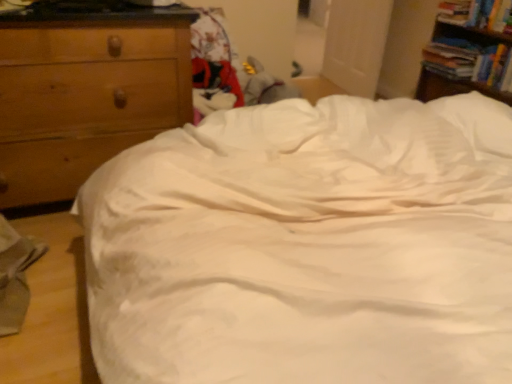
Identify the location of hardcover book at upper right, marked as the 3th book in a top-to-bottom arrangement. (451, 57).

What do you see at coordinates (451, 57) in the screenshot?
I see `hardcover book at upper right, the first book positioned from the bottom` at bounding box center [451, 57].

The width and height of the screenshot is (512, 384). In order to click on wooden bookshelf at upper right in this screenshot , I will do (x=468, y=51).

In order to face hardcover book at upper right, which is counted as the 3th book, starting from the bottom, should I rotate leftwards or rightwards?

Rotate your view right by about 25.763°.

At what (x,y) coordinates should I click in order to perform the action: click on hardcover book at upper right, marked as the 3th book in a top-to-bottom arrangement. Please return your answer as a coordinate pair (x, y). The height and width of the screenshot is (384, 512). Looking at the image, I should click on (451, 57).

Does point (498, 6) lie behind point (450, 40)?

No, (498, 6) is closer to viewer.

Would you say hardcover book at upper right, the 2th book in the bottom-to-top sequence, is outside hardcover book at upper right, the first book positioned from the bottom?

Yes, hardcover book at upper right, the 2th book in the bottom-to-top sequence, is not within hardcover book at upper right, the first book positioned from the bottom.

Does hardcover book at upper right, which is the second book from top to bottom, lie in front of hardcover book at upper right, marked as the 3th book in a top-to-bottom arrangement?

Yes, hardcover book at upper right, which is the second book from top to bottom, is in front of hardcover book at upper right, marked as the 3th book in a top-to-bottom arrangement.

From a real-world perspective, starting from the hardcover book at upper right, which is the second book from top to bottom, which book is the 2nd one below it? Please provide its 2D coordinates.

[(451, 57)]

Which is nearer, (x=476, y=49) or (x=482, y=19)?

Point (x=476, y=49) appears to be farther away from the viewer than point (x=482, y=19).

Is hardcover book at upper right, the 2th book in the bottom-to-top sequence, located within hardcover book at upper right, the first book positioned from the bottom?

That's incorrect, hardcover book at upper right, the 2th book in the bottom-to-top sequence, is not inside hardcover book at upper right, the first book positioned from the bottom.

Considering the sizes of hardcover book at upper right, marked as the 3th book in a top-to-bottom arrangement, and hardcover book at upper right, the 2th book in the bottom-to-top sequence, in the image, is hardcover book at upper right, marked as the 3th book in a top-to-bottom arrangement, wider or thinner than hardcover book at upper right, the 2th book in the bottom-to-top sequence,?

In the image, hardcover book at upper right, marked as the 3th book in a top-to-bottom arrangement, appears to be wider than hardcover book at upper right, the 2th book in the bottom-to-top sequence.

Is hardcover book at upper right, marked as the 3th book in a top-to-bottom arrangement, far from hardcover book at upper right, the 2th book in the bottom-to-top sequence?

hardcover book at upper right, marked as the 3th book in a top-to-bottom arrangement, is near hardcover book at upper right, the 2th book in the bottom-to-top sequence, not far away.

From a real-world perspective, is hardcover book at upper right, which is the second book from top to bottom, physically above hardcover book at upper right, which is counted as the 3th book, starting from the bottom?

Correct, in the physical world, hardcover book at upper right, which is the second book from top to bottom, is higher than hardcover book at upper right, which is counted as the 3th book, starting from the bottom.

Which point is more forward, (505, 23) or (440, 7)?

Point (505, 23)

Based on the photo, is hardcover book at upper right, which is the second book from top to bottom, oriented away from hardcover book at upper right, marked as the 1th book in a top-to-bottom arrangement?

That's not correct — hardcover book at upper right, which is the second book from top to bottom, is not looking away from hardcover book at upper right, marked as the 1th book in a top-to-bottom arrangement.

From a real-world perspective, who is located higher, white satin bed at center or hardcover book at upper right, marked as the 3th book in a top-to-bottom arrangement?

hardcover book at upper right, marked as the 3th book in a top-to-bottom arrangement.

In the scene shown: From the image's perspective, between white satin bed at center and hardcover book at upper right, marked as the 3th book in a top-to-bottom arrangement, which one is located above?

hardcover book at upper right, marked as the 3th book in a top-to-bottom arrangement.

How much distance is there between white satin bed at center and hardcover book at upper right, the first book positioned from the bottom?

white satin bed at center is 1.54 meters away from hardcover book at upper right, the first book positioned from the bottom.

Is white satin bed at center looking in the opposite direction of hardcover book at upper right, the first book positioned from the bottom?

white satin bed at center does not have its back to hardcover book at upper right, the first book positioned from the bottom.

Is wooden chest of drawers at left facing away from hardcover book at upper right, the first book positioned from the bottom?

No, wooden chest of drawers at left is not facing away from hardcover book at upper right, the first book positioned from the bottom.

Is wooden chest of drawers at left outside of hardcover book at upper right, the first book positioned from the bottom?

That's correct, wooden chest of drawers at left is outside of hardcover book at upper right, the first book positioned from the bottom.

From the image's perspective, which one is positioned higher, wooden chest of drawers at left or hardcover book at upper right, the first book positioned from the bottom?

hardcover book at upper right, the first book positioned from the bottom.

Are white satin bed at center and wooden bookshelf at upper right far apart?

Yes, white satin bed at center and wooden bookshelf at upper right are located far from each other.

From the image's perspective, which is above, white satin bed at center or wooden bookshelf at upper right?

wooden bookshelf at upper right appears higher in the image.

From the picture: From a real-world perspective, does white satin bed at center sit lower than wooden bookshelf at upper right?

Yes.

Is white satin bed at center facing away from wooden bookshelf at upper right?

white satin bed at center is not turned away from wooden bookshelf at upper right.

Looking at this image, from the image's perspective, who appears lower, wooden bookshelf at upper right or white satin bed at center?

white satin bed at center.

Can you tell me how much wooden bookshelf at upper right and white satin bed at center differ in facing direction?

0.718 degrees separate the facing orientations of wooden bookshelf at upper right and white satin bed at center.

Is wooden bookshelf at upper right bigger than white satin bed at center?

Actually, wooden bookshelf at upper right might be smaller than white satin bed at center.

From a real-world perspective, relative to white satin bed at center, is wooden bookshelf at upper right vertically above or below?

wooden bookshelf at upper right is above white satin bed at center.

Starting from the hardcover book at upper right, which is the second book from top to bottom, which book is the 2nd one to the left? Please provide its 2D coordinates.

[(451, 57)]

The height and width of the screenshot is (384, 512). Identify the location of the 2nd book positioned above the hardcover book at upper right, marked as the 3th book in a top-to-bottom arrangement (from a real-world perspective). (477, 14).

From the image, which object appears to be farther from white satin bed at center, wooden chest of drawers at left or hardcover book at upper right, marked as the 1th book in a top-to-bottom arrangement?

Among the two, hardcover book at upper right, marked as the 1th book in a top-to-bottom arrangement, is located further to white satin bed at center.

When comparing their distances from hardcover book at upper right, which is the second book from top to bottom, does wooden chest of drawers at left or wooden bookshelf at upper right seem further?

wooden chest of drawers at left lies further to hardcover book at upper right, which is the second book from top to bottom, than the other object.

Based on their spatial positions, is hardcover book at upper right, the 2th book in the bottom-to-top sequence, or white satin bed at center closer to wooden chest of drawers at left?

white satin bed at center lies closer to wooden chest of drawers at left than the other object.

Estimate the real-world distances between objects in this image. Which object is further from hardcover book at upper right, marked as the 1th book in a top-to-bottom arrangement, white satin bed at center or hardcover book at upper right, the 2th book in the bottom-to-top sequence?

Among the two, white satin bed at center is located further to hardcover book at upper right, marked as the 1th book in a top-to-bottom arrangement.

Considering their positions, is wooden bookshelf at upper right positioned closer to hardcover book at upper right, the first book positioned from the bottom, than white satin bed at center?

wooden bookshelf at upper right is positioned closer to the anchor hardcover book at upper right, the first book positioned from the bottom.

In the scene shown: Considering their positions, is white satin bed at center positioned closer to wooden bookshelf at upper right than hardcover book at upper right, the first book positioned from the bottom?

hardcover book at upper right, the first book positioned from the bottom, lies closer to wooden bookshelf at upper right than the other object.

Estimate the real-world distances between objects in this image. Which object is further from hardcover book at upper right, marked as the 3th book in a top-to-bottom arrangement, hardcover book at upper right, the 2th book in the bottom-to-top sequence, or white satin bed at center?

white satin bed at center lies further to hardcover book at upper right, marked as the 3th book in a top-to-bottom arrangement, than the other object.

Looking at the image, which one is located closer to white satin bed at center, hardcover book at upper right, which is the second book from top to bottom, or hardcover book at upper right, marked as the 1th book in a top-to-bottom arrangement?

hardcover book at upper right, which is the second book from top to bottom, is closer to white satin bed at center.

Locate an element on the screen. This screenshot has width=512, height=384. chest of drawers between white satin bed at center and hardcover book at upper right, the first book positioned from the bottom, along the z-axis is located at coordinates (86, 96).

What are the coordinates of `nightstand situated between wooden chest of drawers at left and hardcover book at upper right, the 2th book in the bottom-to-top sequence, from left to right` in the screenshot? It's located at (468, 51).

You are a GUI agent. You are given a task and a screenshot of the screen. Output one action in this format:
    pyautogui.click(x=<x>, y=<y>)
    Task: Click on the book between wooden bookshelf at upper right and hardcover book at upper right, marked as the 3th book in a top-to-bottom arrangement, in the front-back direction
    The height and width of the screenshot is (384, 512).
    Given the screenshot: What is the action you would take?
    pyautogui.click(x=477, y=14)

Where is `bed located between wooden chest of drawers at left and hardcover book at upper right, which is the second book from top to bottom, in the left-right direction`? This screenshot has width=512, height=384. bed located between wooden chest of drawers at left and hardcover book at upper right, which is the second book from top to bottom, in the left-right direction is located at coordinates (307, 246).